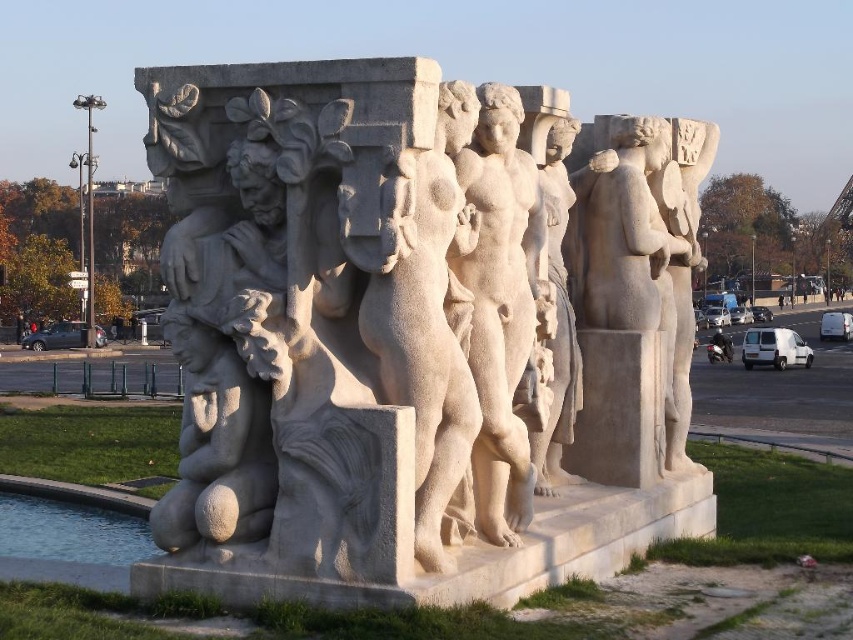
Is smooth stone statue at center in front of matte stone figure at lower left?

That is False.

Who is more distant from viewer, (483, 362) or (181, 528)?

Positioned behind is point (483, 362).

Who is more forward, (486, 353) or (225, 467)?

Positioned in front is point (225, 467).

The width and height of the screenshot is (853, 640). I want to click on smooth stone statue at center, so click(x=502, y=307).

Is point (213, 369) positioned after point (227, 356)?

Yes, it is.

Can you confirm if white stone sculpture at center is taller than matte stone figure at lower left?

Yes.

Is point (297, 333) farther from camera compared to point (178, 452)?

No, (297, 333) is closer to viewer.

Locate an element on the screen. white stone sculpture at center is located at coordinates (372, 348).

Is white stone sculpture at center below smooth stone statue at center?

Indeed, white stone sculpture at center is positioned under smooth stone statue at center.

Which is more to the right, white stone sculpture at center or smooth stone statue at center?

smooth stone statue at center is more to the right.

Between point (224, 547) and point (506, 232), which one is positioned in front?

Point (224, 547) is more forward.

Where is `white stone sculpture at center`? white stone sculpture at center is located at coordinates (372, 348).